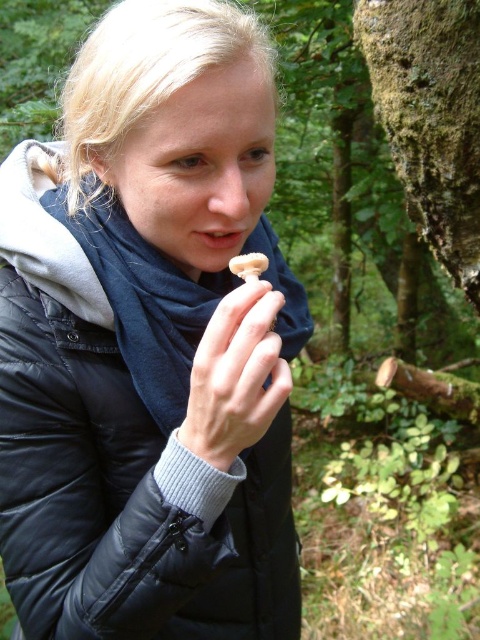
Is black quilted jacket at center taller than white matte mushroom at center?

Indeed, black quilted jacket at center has a greater height compared to white matte mushroom at center.

Can you confirm if black quilted jacket at center is smaller than white matte mushroom at center?

Actually, black quilted jacket at center might be larger than white matte mushroom at center.

Which is in front, point (194, 544) or point (249, 260)?

Point (194, 544)

The width and height of the screenshot is (480, 640). I want to click on black quilted jacket at center, so click(121, 440).

Can you confirm if smooth skin hand at center is smaller than white matte mushroom at center?

Actually, smooth skin hand at center might be larger than white matte mushroom at center.

Is smooth skin hand at center to the left of white matte mushroom at center from the viewer's perspective?

Yes, smooth skin hand at center is to the left of white matte mushroom at center.

Between point (231, 392) and point (260, 257), which one is positioned in front?

Point (231, 392) is more forward.

Locate an element on the screen. The width and height of the screenshot is (480, 640). smooth skin hand at center is located at coordinates (236, 376).

Does black quilted jacket at center lie behind smooth skin hand at center?

Yes.

Is black quilted jacket at center positioned before smooth skin hand at center?

That is False.

Describe the element at coordinates (121, 440) in the screenshot. I see `black quilted jacket at center` at that location.

The width and height of the screenshot is (480, 640). Identify the location of black quilted jacket at center. (121, 440).